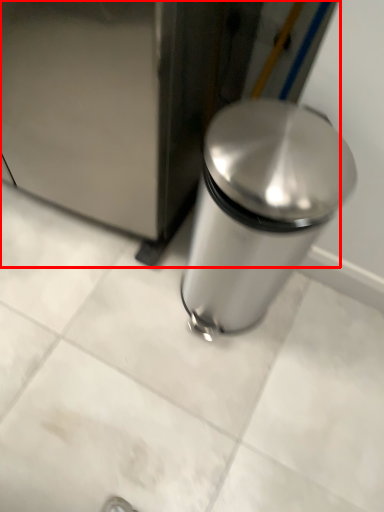
Question: From the image, what is the correct spatial relationship of appliance (annotated by the red box) in relation to waste container?

Choices:
 (A) right
 (B) left

Answer: (B)